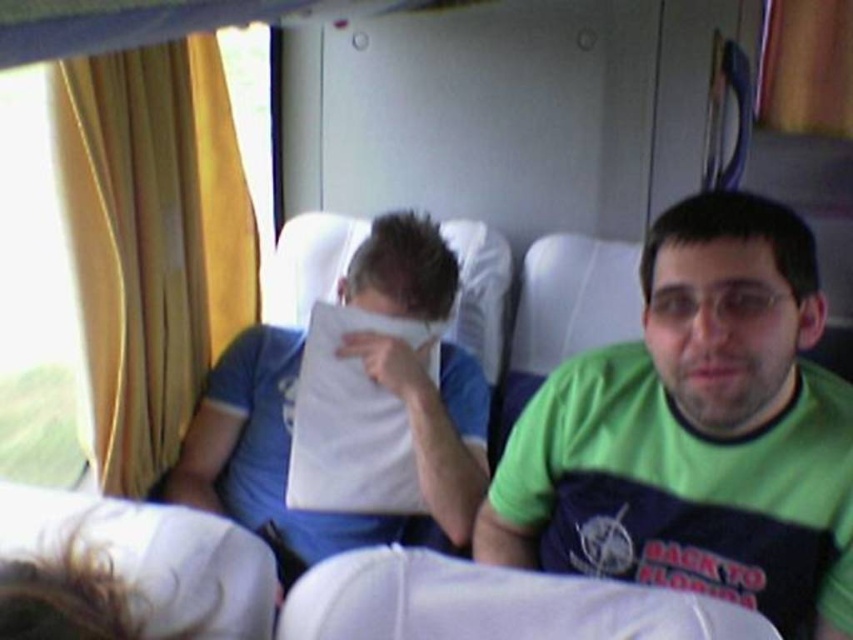
Who is shorter, green jersey at center or white paper at center?

Standing shorter between the two is green jersey at center.

Who is taller, green jersey at center or white paper at center?

white paper at center is taller.

Does point (630, 378) come behind point (306, 525)?

No, (630, 378) is closer to viewer.

You are a GUI agent. You are given a task and a screenshot of the screen. Output one action in this format:
    pyautogui.click(x=<x>, y=<y>)
    Task: Click on the green jersey at center
    
    Given the screenshot: What is the action you would take?
    pyautogui.click(x=695, y=432)